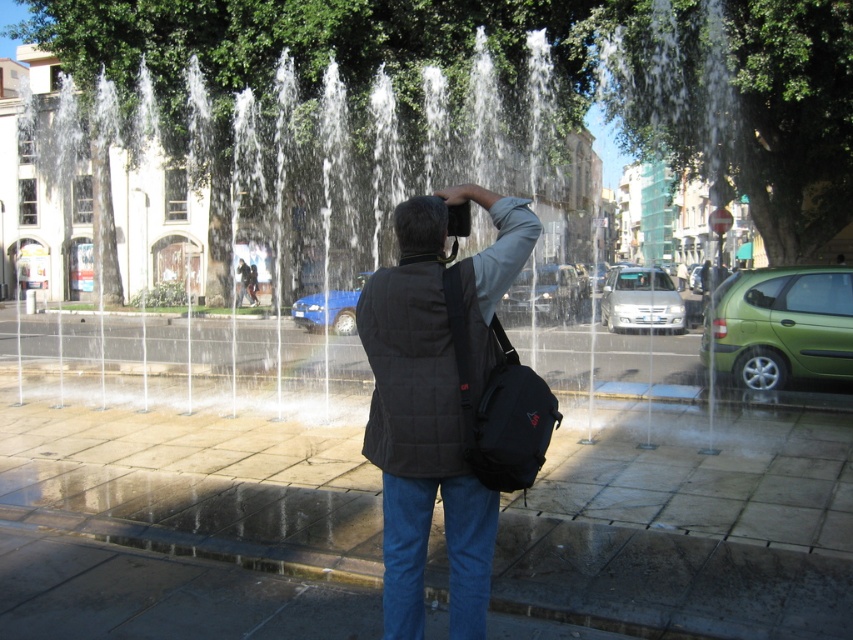
Looking at this image, does dark gray quilted vest at center have a greater height compared to dark gray fabric head at center?

Yes, dark gray quilted vest at center is taller than dark gray fabric head at center.

Does dark gray quilted vest at center appear under dark gray fabric head at center?

Correct, dark gray quilted vest at center is located below dark gray fabric head at center.

Between point (503, 228) and point (436, 227), which one is positioned behind?

Point (503, 228)

The height and width of the screenshot is (640, 853). What are the coordinates of `dark gray quilted vest at center` in the screenshot? It's located at (x=434, y=403).